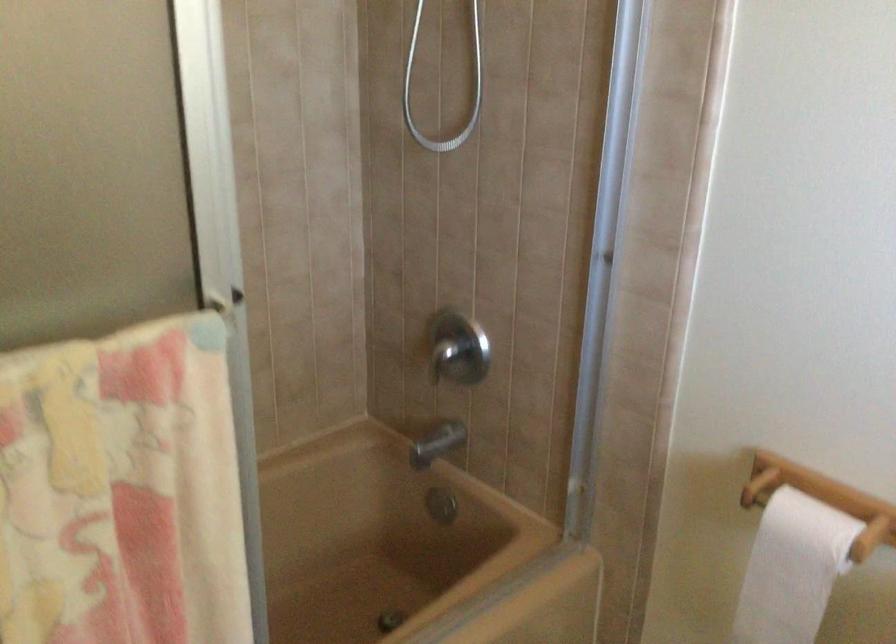
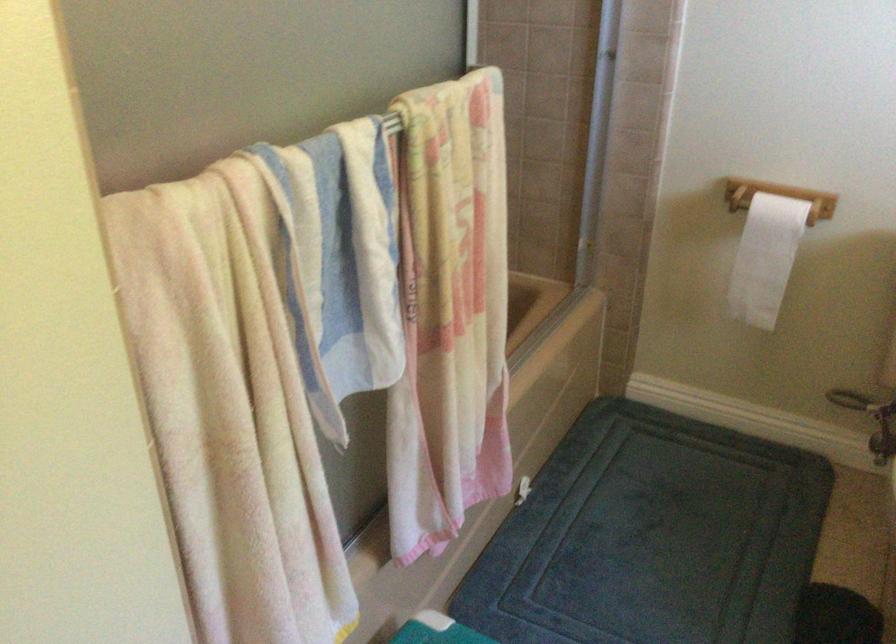
Question: I am providing you with two images of the same scene from different viewpoints. After the viewpoint changes to image2, which objects are now occluded?

Choices:
 (A) white toilet paper
 (B) metal shower handle
 (C) faucet diverter knob
 (D) red leather case

Answer: (C)